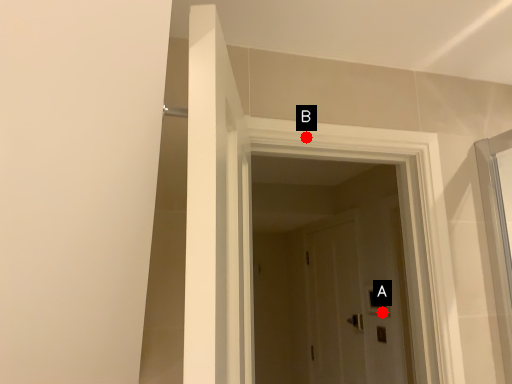
Question: Two points are circled on the image, labeled by A and B beside each circle. Which of the following is the farthest from the observer?

Choices:
 (A) A is further
 (B) B is further

Answer: (A)